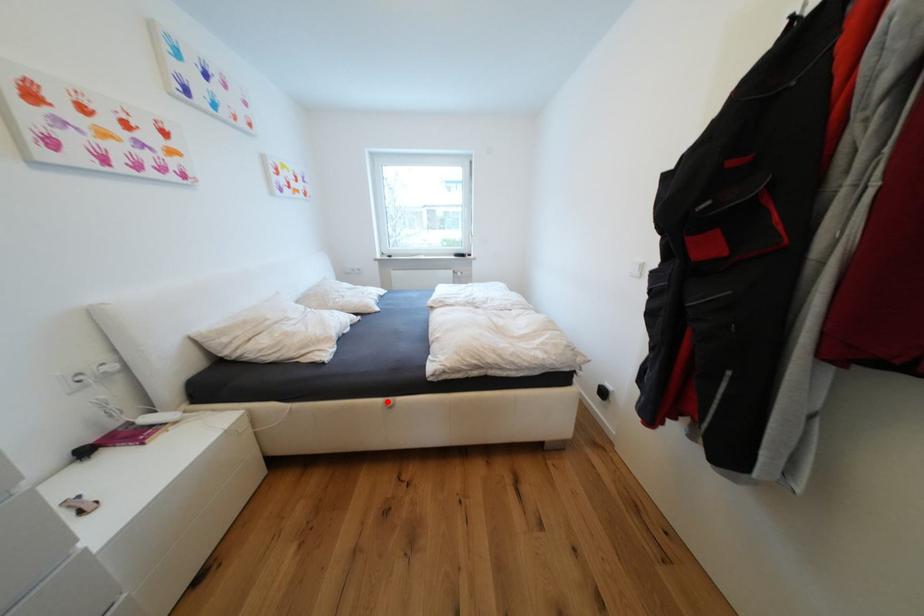
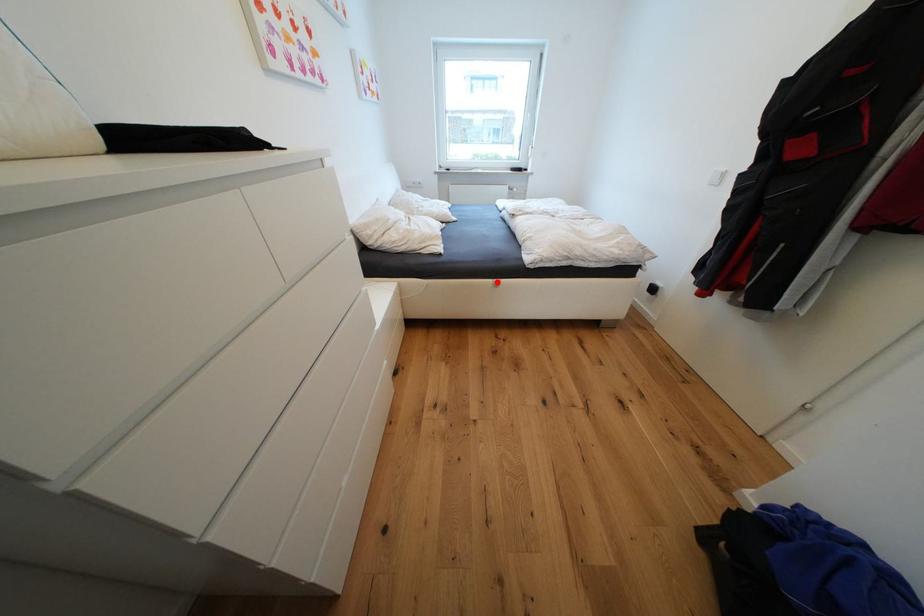
I am providing you with two images of the same scene from different viewpoints. A red point is marked on the first image and another point is marked on the second image. Are the points marked in image1 and image2 representing the same 3D position?

Yes